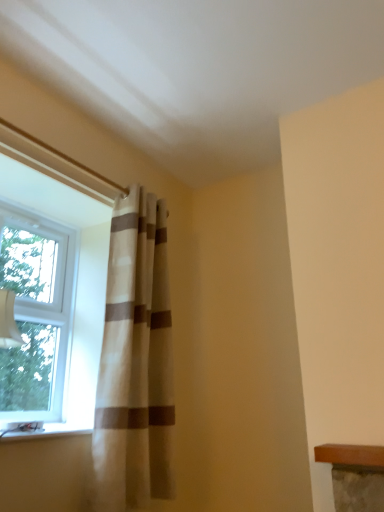
Question: Would you say clear glass window at left contains white glossy window sill at lower left?

Choices:
 (A) yes
 (B) no

Answer: (B)

Question: Is clear glass window at left with white glossy window sill at lower left?

Choices:
 (A) no
 (B) yes

Answer: (A)

Question: Is clear glass window at left smaller than white glossy window sill at lower left?

Choices:
 (A) no
 (B) yes

Answer: (A)

Question: Is clear glass window at left bigger than white glossy window sill at lower left?

Choices:
 (A) no
 (B) yes

Answer: (B)

Question: From a real-world perspective, does clear glass window at left sit lower than white glossy window sill at lower left?

Choices:
 (A) no
 (B) yes

Answer: (A)

Question: Looking at their shapes, would you say clear glass window at left is wider or thinner than white glossy window sill at lower left?

Choices:
 (A) thin
 (B) wide

Answer: (A)

Question: From the image's perspective, relative to white glossy window sill at lower left, is clear glass window at left above or below?

Choices:
 (A) below
 (B) above

Answer: (B)

Question: From a real-world perspective, is clear glass window at left positioned above or below white glossy window sill at lower left?

Choices:
 (A) below
 (B) above

Answer: (B)

Question: Is clear glass window at left inside or outside of white glossy window sill at lower left?

Choices:
 (A) inside
 (B) outside

Answer: (B)

Question: In terms of width, does white glossy window sill at lower left look wider or thinner when compared to clear glass window at left?

Choices:
 (A) thin
 (B) wide

Answer: (B)

Question: Relative to clear glass window at left, is white glossy window sill at lower left in front or behind?

Choices:
 (A) front
 (B) behind

Answer: (A)

Question: From a real-world perspective, relative to clear glass window at left, is white glossy window sill at lower left vertically above or below?

Choices:
 (A) below
 (B) above

Answer: (A)

Question: Choose the correct answer: Is white glossy window sill at lower left inside clear glass window at left or outside it?

Choices:
 (A) inside
 (B) outside

Answer: (B)

Question: Visually, is white glossy window sill at lower left positioned to the left or to the right of beige textured curtain at left?

Choices:
 (A) left
 (B) right

Answer: (A)

Question: In the image, is white glossy window sill at lower left positioned in front of or behind beige textured curtain at left?

Choices:
 (A) front
 (B) behind

Answer: (A)